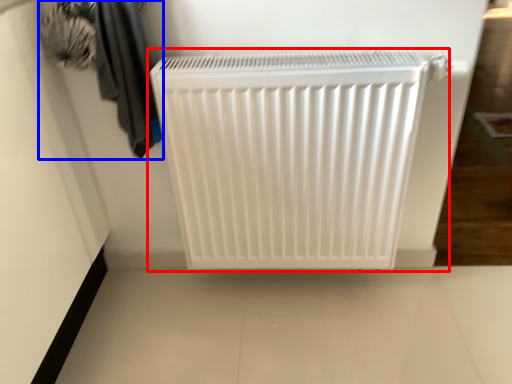
Question: Which of the following is the farthest to the observer, home appliance (highlighted by a red box) or laundry (highlighted by a blue box)?

Choices:
 (A) home appliance
 (B) laundry

Answer: (A)